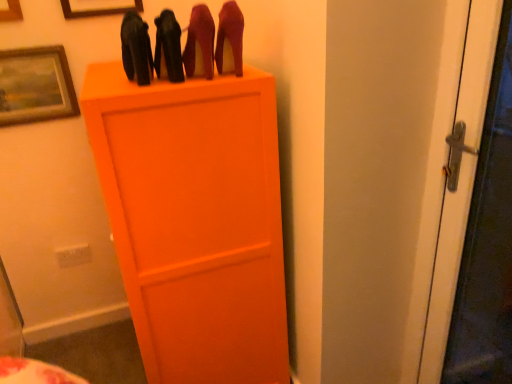
Question: Can you confirm if wooden picture frame at upper left, placed as the first picture frame when sorted from top to bottom, is positioned to the left of matte black high-heels at upper center, which appears as the first stuff when viewed from the left?

Choices:
 (A) yes
 (B) no

Answer: (A)

Question: Is wooden picture frame at upper left, the third picture frame ordered from the bottom, facing away from matte black high-heels at upper center, which appears as the first stuff when viewed from the left?

Choices:
 (A) yes
 (B) no

Answer: (B)

Question: Can you confirm if wooden picture frame at upper left, placed as the first picture frame when sorted from top to bottom, is thinner than matte black high-heels at upper center, the 3th stuff from the right?

Choices:
 (A) no
 (B) yes

Answer: (B)

Question: Is wooden picture frame at upper left, the third picture frame ordered from the bottom, outside of matte black high-heels at upper center, the 3th stuff from the right?

Choices:
 (A) no
 (B) yes

Answer: (B)

Question: Are wooden picture frame at upper left, placed as the first picture frame when sorted from top to bottom, and matte black high-heels at upper center, the 3th stuff from the right, making contact?

Choices:
 (A) no
 (B) yes

Answer: (A)

Question: Is matte black high-heels at upper center, the 3th stuff from the right, inside or outside of shiny leather high-heels at upper center, the third stuff in the left-to-right sequence?

Choices:
 (A) outside
 (B) inside

Answer: (A)

Question: Considering the positions of matte black high-heels at upper center, the 3th stuff from the right, and shiny leather high-heels at upper center, the first stuff from the right, in the image, is matte black high-heels at upper center, the 3th stuff from the right, wider or thinner than shiny leather high-heels at upper center, the first stuff from the right,?

Choices:
 (A) thin
 (B) wide

Answer: (B)

Question: From the image's perspective, is matte black high-heels at upper center, the 3th stuff from the right, above or below shiny leather high-heels at upper center, the third stuff in the left-to-right sequence?

Choices:
 (A) below
 (B) above

Answer: (A)

Question: Based on their positions, is matte black high-heels at upper center, which appears as the first stuff when viewed from the left, located to the left or right of shiny leather high-heels at upper center, the first stuff from the right?

Choices:
 (A) left
 (B) right

Answer: (A)

Question: Looking at the image, does wooden picture frame at upper left, placed as the first picture frame when sorted from top to bottom, seem bigger or smaller compared to matte black shoes at upper center, which is counted as the second stuff, starting from the left?

Choices:
 (A) big
 (B) small

Answer: (B)

Question: Is wooden picture frame at upper left, the third picture frame ordered from the bottom, inside the boundaries of matte black shoes at upper center, the second stuff when ordered from right to left, or outside?

Choices:
 (A) outside
 (B) inside

Answer: (A)

Question: Is wooden picture frame at upper left, the third picture frame ordered from the bottom, in front of or behind matte black shoes at upper center, the second stuff when ordered from right to left, in the image?

Choices:
 (A) behind
 (B) front

Answer: (A)

Question: From a real-world perspective, is wooden picture frame at upper left, placed as the first picture frame when sorted from top to bottom, positioned above or below matte black shoes at upper center, the second stuff when ordered from right to left?

Choices:
 (A) above
 (B) below

Answer: (A)

Question: From a real-world perspective, relative to wooden picture frame at upper left, the 2th picture frame in the bottom-to-top sequence, is matte black shoes at upper center, the second stuff when ordered from right to left, vertically above or below?

Choices:
 (A) above
 (B) below

Answer: (B)

Question: Would you say matte black shoes at upper center, which is counted as the second stuff, starting from the left, is to the left or to the right of wooden picture frame at upper left, the 2th picture frame in the bottom-to-top sequence, in the picture?

Choices:
 (A) right
 (B) left

Answer: (A)